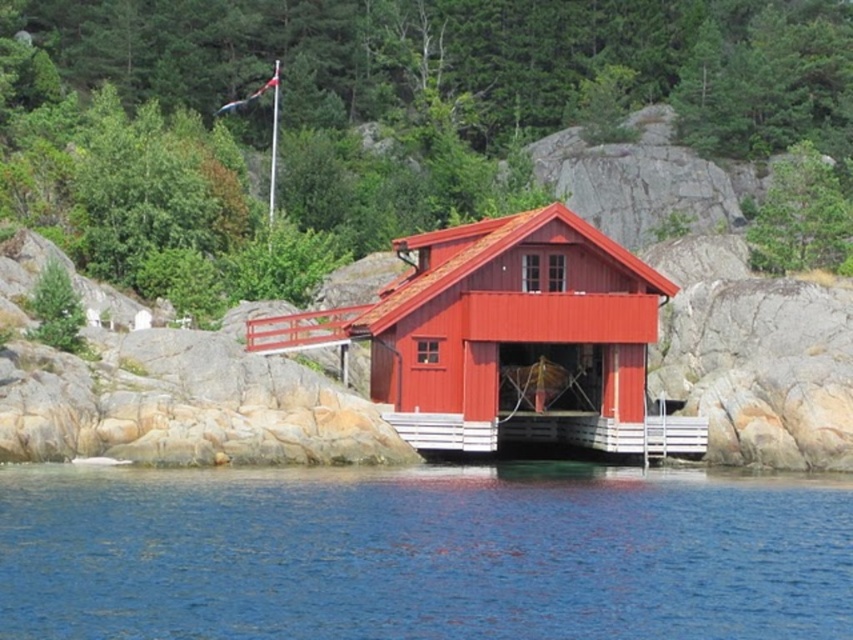
You are standing on the rocky shoreline looking at the matte red cabin at center and the white wooden dock at center. Which object is positioned to the left of the other?

The matte red cabin at center is to the left of the white wooden dock at center.

You are standing on the white wooden dock at center and want to reach the blue water at lower center. In which direction should you move?

You should move to the left to reach the blue water at lower center since it is located to the left of the white wooden dock at center.

You are standing at the camera position and want to reach point (62,472). Is the distance more than 50 meters?

Yes, the distance between the camera and point (62,472) is 59.00 meters, which is more than 50 meters.